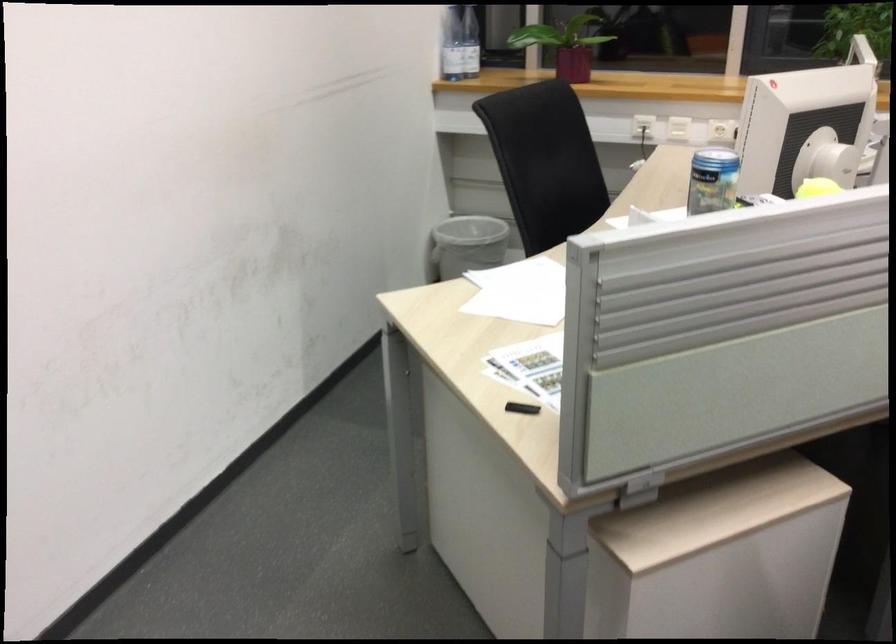
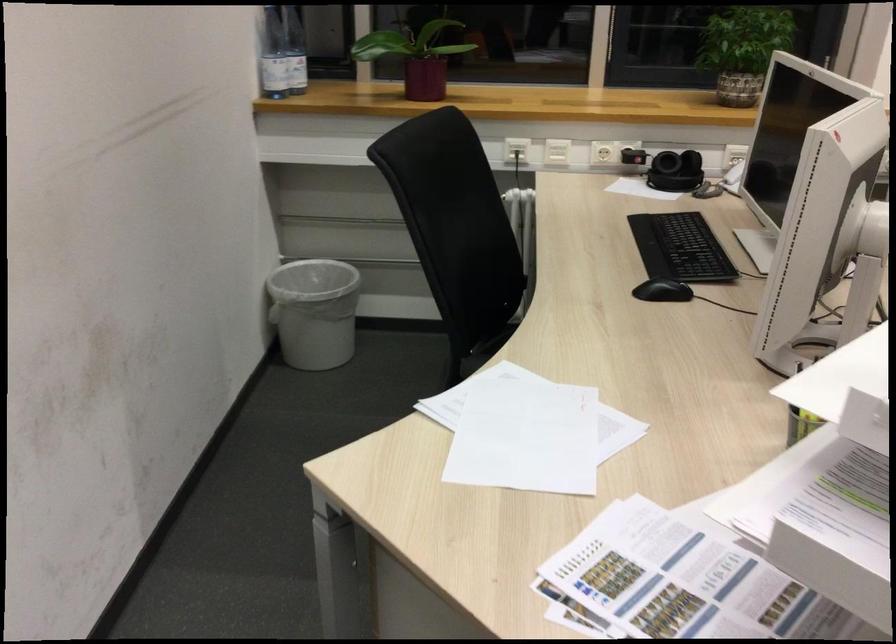
Looking at this image, the images are taken continuously from a first-person perspective. In which direction are you moving?

The cameraman moved toward left, forward.